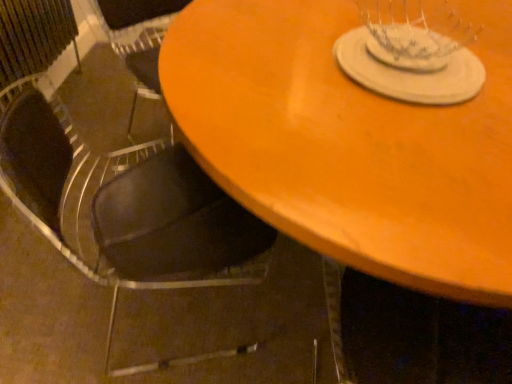
Locate an element on the screen. free spot behind white matte glass plate at upper center is located at coordinates (404, 11).